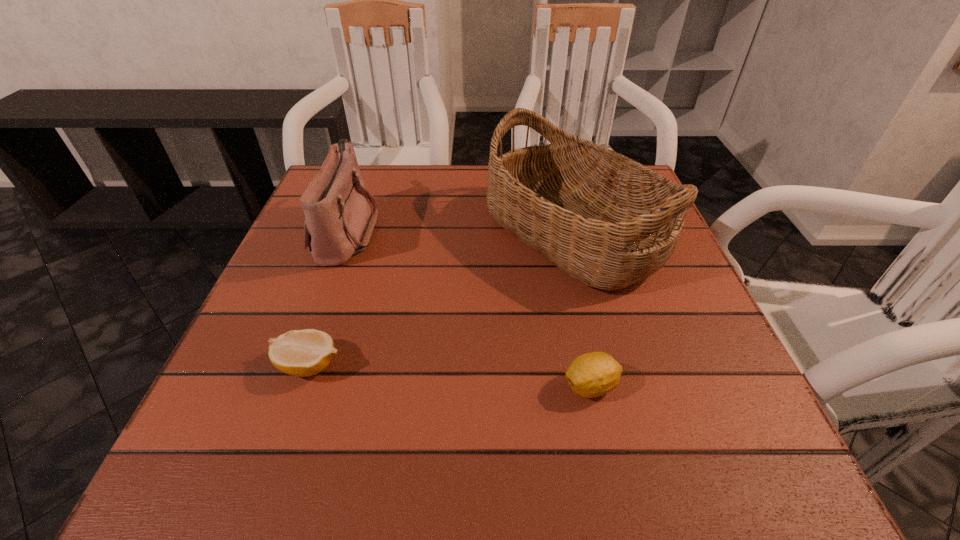
Where is `vacant region located at the stem end of the second shortest object`? vacant region located at the stem end of the second shortest object is located at coordinates (346, 386).

The image size is (960, 540). Identify the location of vacant space located on the front of the left lemon. (291, 416).

This screenshot has width=960, height=540. I want to click on basket located at the far edge, so click(x=608, y=221).

Locate an element on the screen. The height and width of the screenshot is (540, 960). shoulder bag at the far edge is located at coordinates (338, 223).

Where is `shoulder bag at the left edge`? This screenshot has height=540, width=960. shoulder bag at the left edge is located at coordinates (338, 223).

Find the location of a particular element. Image resolution: width=960 pixels, height=540 pixels. lemon that is at the left edge is located at coordinates (303, 353).

Locate an element on the screen. Image resolution: width=960 pixels, height=540 pixels. object located at the right edge is located at coordinates (608, 221).

Find the location of a particular element. Image resolution: width=960 pixels, height=540 pixels. object at the far left corner is located at coordinates (338, 223).

At what (x,y) coordinates should I click in order to perform the action: click on object located in the far right corner section of the desktop. Please return your answer as a coordinate pair (x, y). The image size is (960, 540). Looking at the image, I should click on (608, 221).

Locate an element on the screen. The height and width of the screenshot is (540, 960). free spot at the far edge of the desktop is located at coordinates (483, 213).